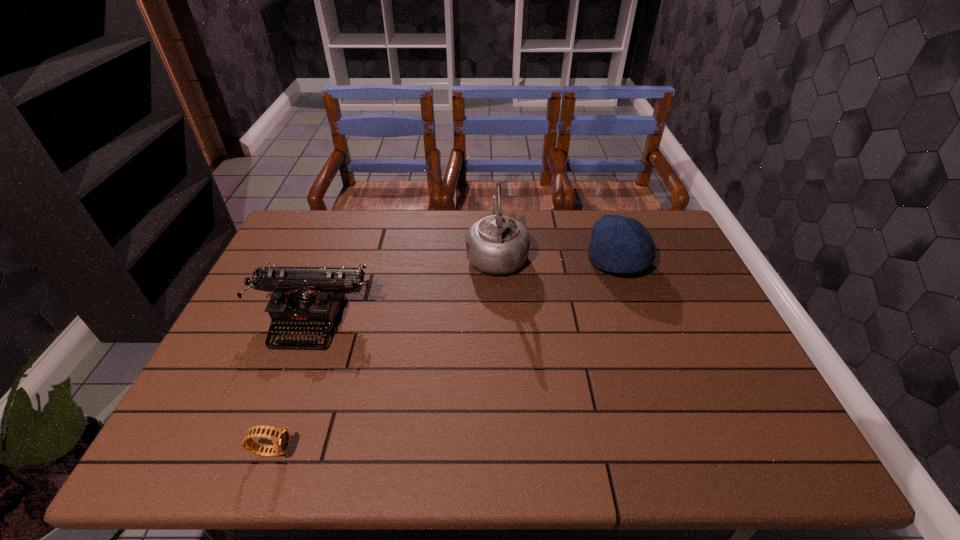
Locate an element on the screen. kettle present at the far edge is located at coordinates (497, 245).

Locate an element on the screen. The height and width of the screenshot is (540, 960). skullcap that is at the far edge is located at coordinates (618, 244).

Find the location of a particular element. The width and height of the screenshot is (960, 540). object that is at the near edge is located at coordinates (280, 437).

At what (x,y) coordinates should I click in order to perform the action: click on object located at the left edge. Please return your answer as a coordinate pair (x, y). Looking at the image, I should click on (306, 299).

This screenshot has height=540, width=960. I want to click on object that is at the right edge, so click(618, 244).

Find the location of `object at the far right corner`. object at the far right corner is located at coordinates (618, 244).

In the image, there is a desktop. Where is `free space at the far edge`? This screenshot has width=960, height=540. free space at the far edge is located at coordinates (530, 249).

Locate an element on the screen. vacant space at the near edge of the desktop is located at coordinates (494, 456).

Locate an element on the screen. free space at the left edge of the desktop is located at coordinates (320, 259).

Find the location of `vacant space at the right edge of the desktop`. vacant space at the right edge of the desktop is located at coordinates (662, 255).